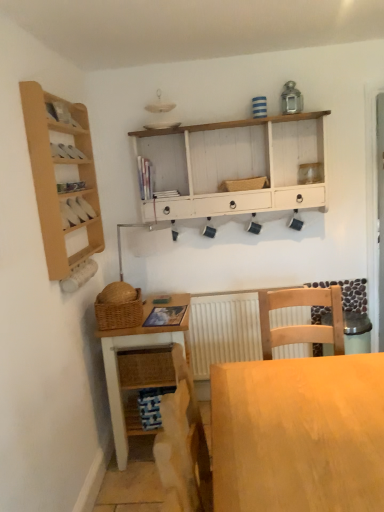
Question: Is white textured radiator at center bigger than white painted wood cabinet at upper center?

Choices:
 (A) no
 (B) yes

Answer: (A)

Question: Is white textured radiator at center far away from white painted wood cabinet at upper center?

Choices:
 (A) yes
 (B) no

Answer: (B)

Question: Is white textured radiator at center turned away from white painted wood cabinet at upper center?

Choices:
 (A) yes
 (B) no

Answer: (B)

Question: Is white painted wood cabinet at upper center completely or partially inside white textured radiator at center?

Choices:
 (A) yes
 (B) no

Answer: (B)

Question: Is white textured radiator at center in contact with white painted wood cabinet at upper center?

Choices:
 (A) yes
 (B) no

Answer: (B)

Question: From the image's perspective, is wooden cabinet at left located above or below woven brown picnic basket at lower left?

Choices:
 (A) below
 (B) above

Answer: (B)

Question: Is point (67, 207) closer or farther from the camera than point (125, 309)?

Choices:
 (A) farther
 (B) closer

Answer: (B)

Question: Is wooden cabinet at left bigger or smaller than woven brown picnic basket at lower left?

Choices:
 (A) big
 (B) small

Answer: (B)

Question: From a real-world perspective, is wooden cabinet at left positioned above or below woven brown picnic basket at lower left?

Choices:
 (A) above
 (B) below

Answer: (A)

Question: In terms of height, does light wood desk at center look taller or shorter compared to woven brown picnic basket at lower left?

Choices:
 (A) tall
 (B) short

Answer: (A)

Question: Considering the positions of light wood desk at center and woven brown picnic basket at lower left in the image, is light wood desk at center wider or thinner than woven brown picnic basket at lower left?

Choices:
 (A) wide
 (B) thin

Answer: (A)

Question: Is light wood desk at center inside or outside of woven brown picnic basket at lower left?

Choices:
 (A) outside
 (B) inside

Answer: (A)

Question: Visually, is light wood desk at center positioned to the left or to the right of woven brown picnic basket at lower left?

Choices:
 (A) left
 (B) right

Answer: (B)

Question: Considering the relative positions of light wood desk at center and white textured radiator at center in the image provided, is light wood desk at center to the left or to the right of white textured radiator at center?

Choices:
 (A) right
 (B) left

Answer: (A)

Question: Does point (291, 365) appear closer or farther from the camera than point (213, 320)?

Choices:
 (A) farther
 (B) closer

Answer: (B)